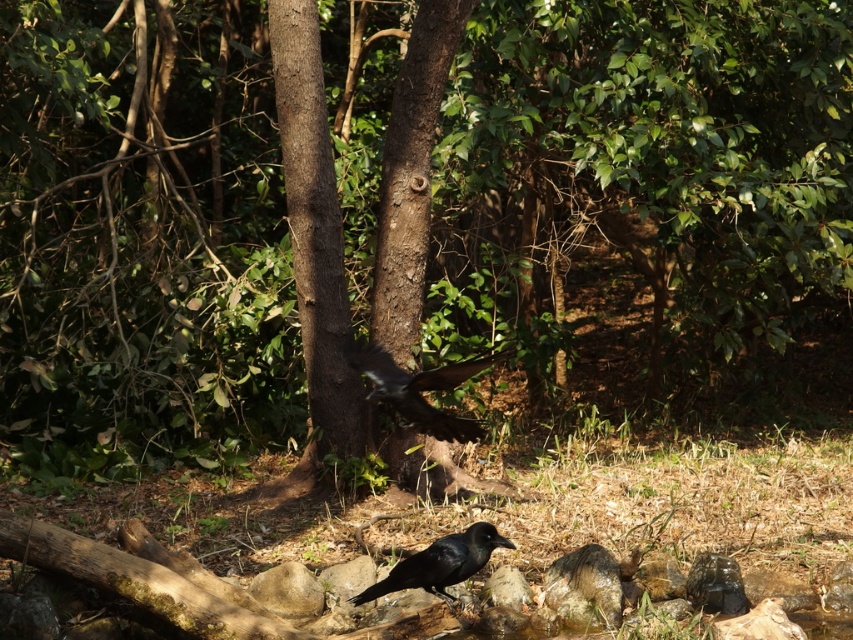
Question: Does shiny black raven at center appear on the left side of shiny black raven at lower center?

Choices:
 (A) yes
 (B) no

Answer: (A)

Question: Is shiny black raven at center to the right of shiny black raven at lower center from the viewer's perspective?

Choices:
 (A) no
 (B) yes

Answer: (A)

Question: Is shiny black raven at center positioned behind shiny black raven at lower center?

Choices:
 (A) no
 (B) yes

Answer: (A)